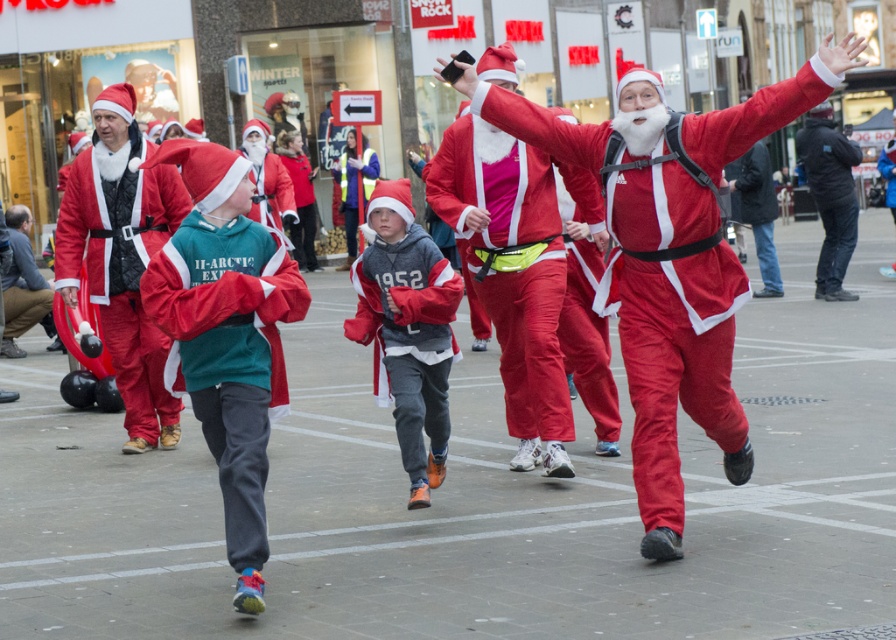
Does gray fleece jacket at center come behind black leather jacket at right?

No.

How much distance is there between gray fleece jacket at center and black leather jacket at right?

They are 33.47 feet apart.

Is point (438, 385) farther from camera compared to point (794, 141)?

No, (438, 385) is closer to viewer.

At what (x,y) coordinates should I click in order to perform the action: click on gray fleece jacket at center. Please return your answer as a coordinate pair (x, y). Looking at the image, I should click on (408, 328).

Can you confirm if matte red santa suit at center is positioned above matte black coat at left?

No, matte red santa suit at center is not above matte black coat at left.

Between matte red santa suit at center and matte black coat at left, which one is positioned higher?

matte black coat at left is higher up.

Is point (171, 147) closer to viewer compared to point (119, 316)?

That is True.

I want to click on matte red santa suit at center, so click(x=226, y=336).

Who is shorter, matte red santa at center or matte black coat at left?

matte red santa at center is shorter.

Does point (830, 88) come farther from viewer compared to point (148, 225)?

That is False.

Does point (467, 77) come farther from viewer compared to point (117, 369)?

No, (467, 77) is closer to viewer.

The width and height of the screenshot is (896, 640). Identify the location of matte red santa at center. (669, 259).